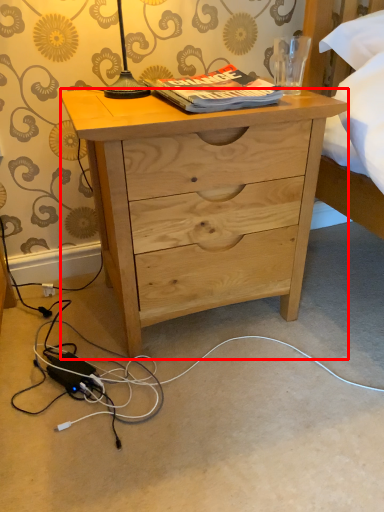
Question: From the image's perspective, where is desk (annotated by the red box) located relative to book?

Choices:
 (A) above
 (B) below

Answer: (B)